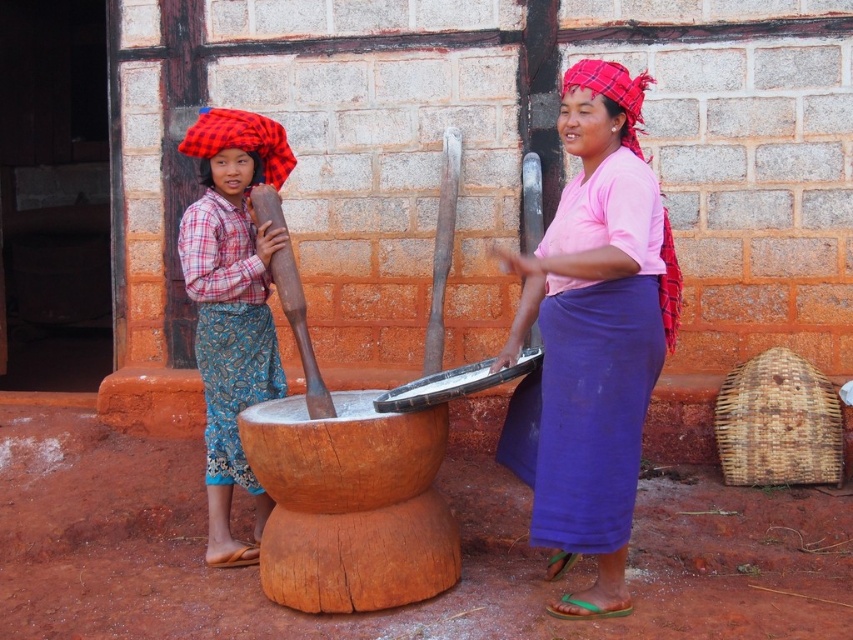
Does pink fabric skirt at center have a lesser height compared to plaid fabric headscarf at left?

In fact, pink fabric skirt at center may be taller than plaid fabric headscarf at left.

Is pink fabric skirt at center positioned behind plaid fabric headscarf at left?

No, it is in front of plaid fabric headscarf at left.

Find the location of a particular element. The height and width of the screenshot is (640, 853). pink fabric skirt at center is located at coordinates (592, 337).